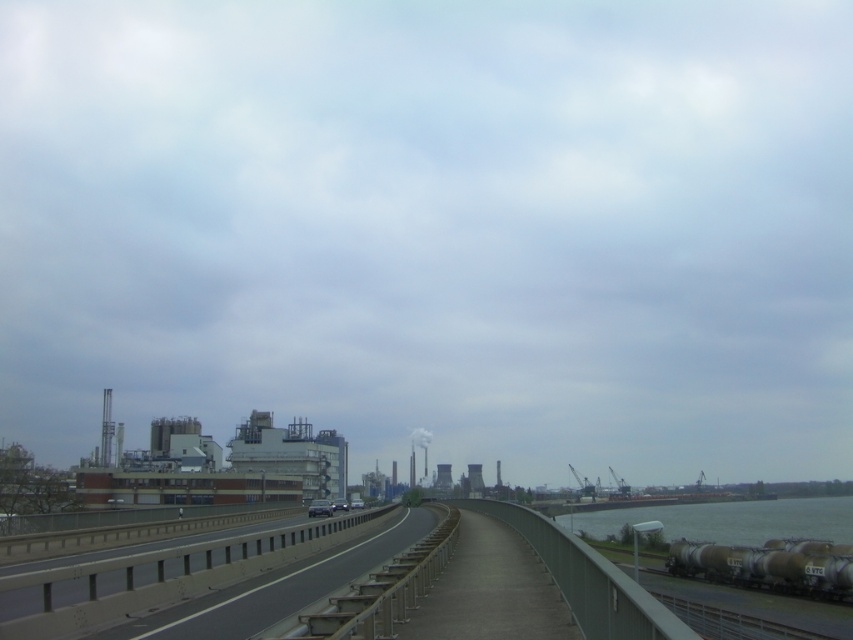
Who is higher up, gray metallic water at lower right or silver metallic train carriages at lower right?

silver metallic train carriages at lower right is above.

In the scene shown: Between gray metallic water at lower right and silver metallic train carriages at lower right, which one has less height?

silver metallic train carriages at lower right is shorter.

What do you see at coordinates (727, 518) in the screenshot? I see `gray metallic water at lower right` at bounding box center [727, 518].

Find the location of a particular element. The width and height of the screenshot is (853, 640). gray metallic water at lower right is located at coordinates (727, 518).